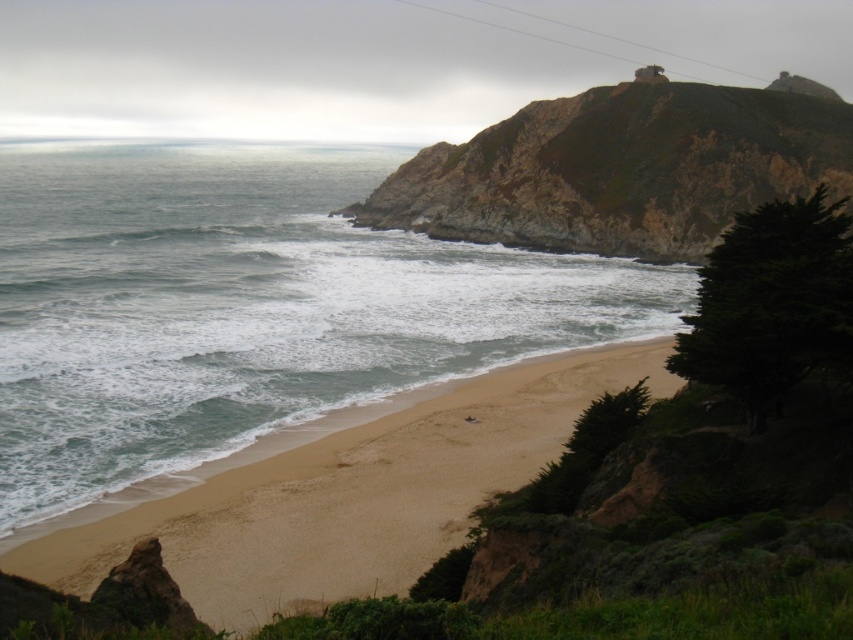
Who is taller, light brown sand at lower center or rugged rock cliff at upper right?

Standing taller between the two is rugged rock cliff at upper right.

Is point (386, 564) behind point (669, 97)?

No, it is in front of (669, 97).

Is point (430, 454) positioned after point (815, 184)?

No, (430, 454) is in front of (815, 184).

This screenshot has height=640, width=853. Identify the location of light brown sand at lower center. (351, 493).

Does greenish-blue water at center have a larger size compared to rugged rock cliff at upper right?

Yes.

Who is shorter, greenish-blue water at center or rugged rock cliff at upper right?

rugged rock cliff at upper right

I want to click on greenish-blue water at center, so click(245, 312).

Identify the location of greenish-blue water at center. (245, 312).

Can you confirm if greenish-blue water at center is positioned below light brown sand at lower center?

No, greenish-blue water at center is not below light brown sand at lower center.

Is the position of greenish-blue water at center more distant than that of light brown sand at lower center?

Yes, greenish-blue water at center is further from the viewer.

In the scene shown: Who is more forward, (276, 301) or (389, 509)?

Positioned in front is point (389, 509).

Locate an element on the screen. greenish-blue water at center is located at coordinates (245, 312).